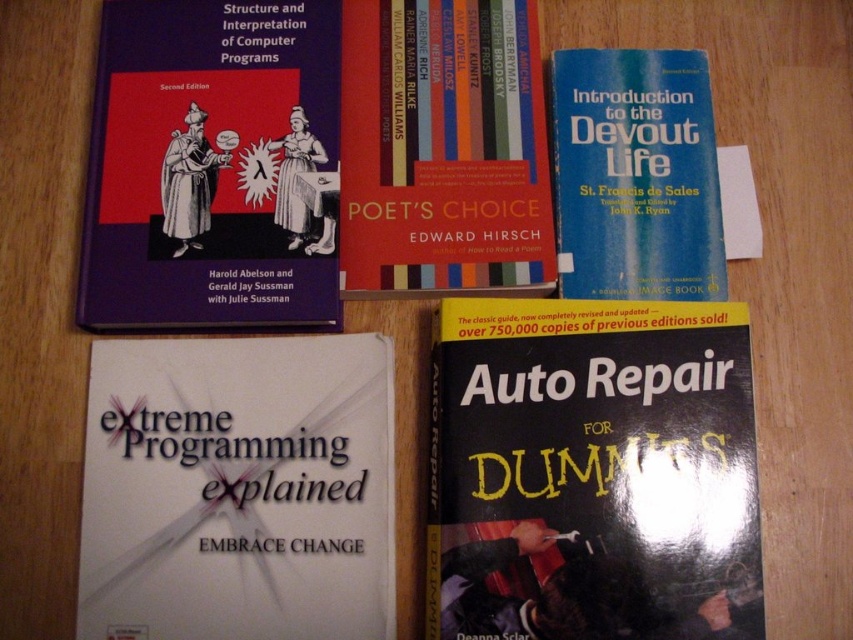
Question: Which of these objects is positioned closest to the white paper at lower left?

Choices:
 (A) black glossy book at lower right
 (B) red matte book at upper center

Answer: (A)

Question: Is white paper at lower left below matte hardcover book at upper left?

Choices:
 (A) no
 (B) yes

Answer: (B)

Question: Estimate the real-world distances between objects in this image. Which object is farther from the black glossy book at lower right?

Choices:
 (A) blue hardcover book at upper right
 (B) white paper at lower left
 (C) matte hardcover book at upper left
 (D) red matte book at upper center

Answer: (C)

Question: Can you confirm if black glossy book at lower right is wider than blue hardcover book at upper right?

Choices:
 (A) yes
 (B) no

Answer: (A)

Question: Is black glossy book at lower right in front of red matte book at upper center?

Choices:
 (A) yes
 (B) no

Answer: (A)

Question: Which of the following is the closest to the observer?

Choices:
 (A) blue hardcover book at upper right
 (B) white paper at lower left
 (C) matte hardcover book at upper left
 (D) red matte book at upper center

Answer: (B)